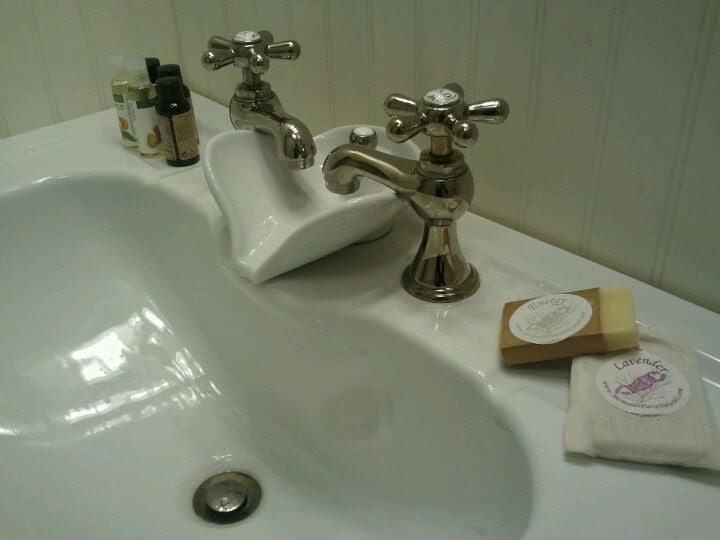
At what (x,y) coordinates should I click in order to perform the action: click on wall behind sink. Please return your answer as a coordinate pair (x, y). This screenshot has width=720, height=540. Looking at the image, I should click on (553, 105).